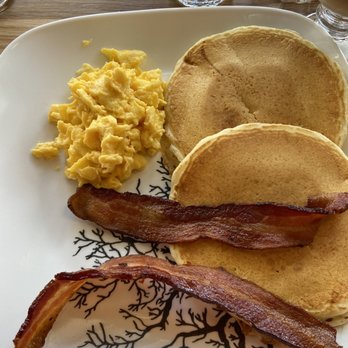
Where is `ceramic`? The width and height of the screenshot is (348, 348). ceramic is located at coordinates (163, 38).